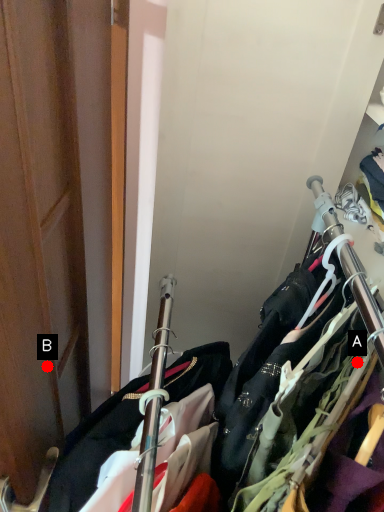
Question: Two points are circled on the image, labeled by A and B beside each circle. Which point is closer to the camera taking this photo?

Choices:
 (A) A is closer
 (B) B is closer

Answer: (A)